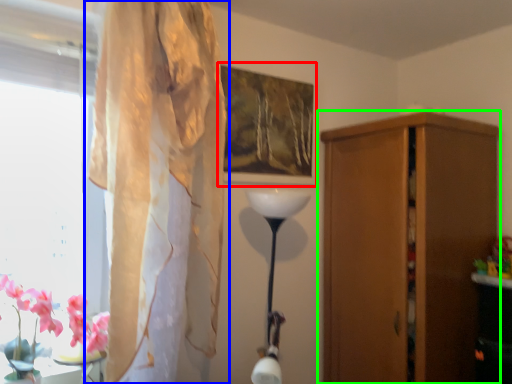
Question: Which is farther away from picture frame (highlighted by a red box)? curtain (highlighted by a blue box) or cupboard (highlighted by a green box)?

Choices:
 (A) curtain
 (B) cupboard

Answer: (B)